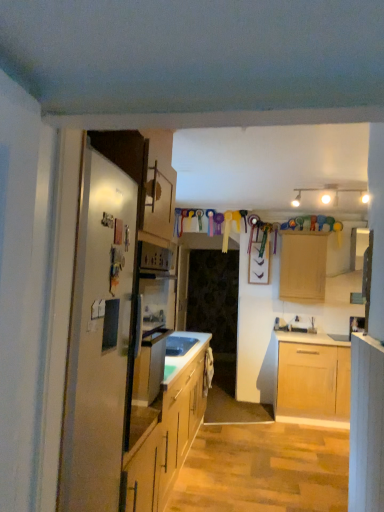
Measure the distance between light wood cabinet at upper center, which appears as the second cabinetry when viewed from the left, and camera.

They are 4.90 meters apart.

This screenshot has height=512, width=384. What are the coordinates of `white glossy sink at center` in the screenshot? It's located at 179,345.

Is light wood cabinet at upper center, which is counted as the first cabinetry, starting from the right, bigger or smaller than white glossy sink at center?

Clearly, light wood cabinet at upper center, which is counted as the first cabinetry, starting from the right, is larger in size than white glossy sink at center.

From a real-world perspective, is light wood cabinet at upper center, which is counted as the first cabinetry, starting from the right, positioned under white glossy sink at center based on gravity?

Incorrect, from a real-world perspective, light wood cabinet at upper center, which is counted as the first cabinetry, starting from the right, is higher than white glossy sink at center.

Who is shorter, light wood cabinet at upper center, marked as the first cabinetry in a back-to-front arrangement, or white glossy sink at center?

white glossy sink at center is shorter.

Measure the distance from light wood cabinet at upper center, which is counted as the first cabinetry, starting from the right, to white glossy sink at center.

light wood cabinet at upper center, which is counted as the first cabinetry, starting from the right, is 6.34 feet away from white glossy sink at center.

Does transparent glass door at center have a greater height compared to light wood cabinet at right, placed as the first cabinetry when sorted from left to right?

Indeed, transparent glass door at center has a greater height compared to light wood cabinet at right, placed as the first cabinetry when sorted from left to right.

Is transparent glass door at center facing away from light wood cabinet at right, acting as the 2th cabinetry starting from the right?

No, transparent glass door at center is not facing away from light wood cabinet at right, acting as the 2th cabinetry starting from the right.

The width and height of the screenshot is (384, 512). What are the coordinates of `glass door lying on the left of light wood cabinet at right, which is the first cabinetry from front to back` in the screenshot? It's located at (211, 297).

Does transparent glass door at center have a greater height compared to light wood cabinet at upper center, the second cabinetry viewed from the front?

Yes.

From a real-world perspective, is transparent glass door at center physically above light wood cabinet at upper center, which is counted as the first cabinetry, starting from the right?

No.

Considering the relative sizes of transparent glass door at center and light wood cabinet at upper center, the second cabinetry viewed from the front, in the image provided, is transparent glass door at center thinner than light wood cabinet at upper center, the second cabinetry viewed from the front,?

Indeed, transparent glass door at center has a lesser width compared to light wood cabinet at upper center, the second cabinetry viewed from the front.

Is transparent glass door at center facing away from light wood cabinet at upper center, the second cabinetry viewed from the front?

No, transparent glass door at center is not facing the opposite direction of light wood cabinet at upper center, the second cabinetry viewed from the front.

From a real-world perspective, is satin silver refrigerator at left physically above transparent glass door at center?

Yes.

Consider the image. How distant is satin silver refrigerator at left from transparent glass door at center?

3.74 meters.

From the image's perspective, is satin silver refrigerator at left located above transparent glass door at center?

Correct, satin silver refrigerator at left appears higher than transparent glass door at center in the image.

Is satin silver refrigerator at left further to camera compared to transparent glass door at center?

That is False.

Considering the positions of objects white glossy sink at center and light wood cabinet at upper center, which appears as the second cabinetry when viewed from the left, in the image provided, who is more to the right, white glossy sink at center or light wood cabinet at upper center, which appears as the second cabinetry when viewed from the left,?

light wood cabinet at upper center, which appears as the second cabinetry when viewed from the left, is more to the right.

Is light wood cabinet at upper center, marked as the first cabinetry in a back-to-front arrangement, located within white glossy sink at center?

No, light wood cabinet at upper center, marked as the first cabinetry in a back-to-front arrangement, is located outside of white glossy sink at center.

Is white glossy sink at center thinner than light wood cabinet at upper center, which appears as the second cabinetry when viewed from the left?

Indeed, white glossy sink at center has a lesser width compared to light wood cabinet at upper center, which appears as the second cabinetry when viewed from the left.

Can you confirm if satin silver refrigerator at left is taller than light wood cabinet at upper center, marked as the first cabinetry in a back-to-front arrangement?

Yes.

Considering the positions of point (111, 488) and point (310, 240), is point (111, 488) closer or farther from the camera than point (310, 240)?

Clearly, point (111, 488) is closer to the camera than point (310, 240).

Can we say satin silver refrigerator at left lies outside light wood cabinet at upper center, which is counted as the first cabinetry, starting from the right?

Yes, satin silver refrigerator at left is outside of light wood cabinet at upper center, which is counted as the first cabinetry, starting from the right.

Does satin silver refrigerator at left have a larger size compared to light wood cabinet at upper center, the second cabinetry viewed from the front?

Indeed, satin silver refrigerator at left has a larger size compared to light wood cabinet at upper center, the second cabinetry viewed from the front.

From a real-world perspective, is satin silver refrigerator at left below light wood cabinet at right, acting as the 2th cabinetry starting from the right?

No, from a real-world perspective, satin silver refrigerator at left is not under light wood cabinet at right, acting as the 2th cabinetry starting from the right.

Is satin silver refrigerator at left to the left or to the right of light wood cabinet at right, the second cabinetry viewed from the back, in the image?

satin silver refrigerator at left is to the left of light wood cabinet at right, the second cabinetry viewed from the back.

Can light wood cabinet at right, which is the first cabinetry from front to back, be found inside satin silver refrigerator at left?

No, light wood cabinet at right, which is the first cabinetry from front to back, is not a part of satin silver refrigerator at left.

Would you say satin silver refrigerator at left is a long distance from light wood cabinet at right, placed as the first cabinetry when sorted from left to right?

No, satin silver refrigerator at left is not far away from light wood cabinet at right, placed as the first cabinetry when sorted from left to right.

Image resolution: width=384 pixels, height=512 pixels. In order to click on sink on the left of the light wood cabinet at upper center, the second cabinetry viewed from the front in this screenshot , I will do `click(179, 345)`.

The image size is (384, 512). Identify the location of glass door that appears behind the light wood cabinet at right, the second cabinetry viewed from the back. (211, 297).

Based on the photo, considering their positions, is transparent glass door at center positioned closer to white glossy sink at center than light wood cabinet at upper center, marked as the first cabinetry in a back-to-front arrangement?

Among the two, transparent glass door at center is located nearer to white glossy sink at center.

Estimate the real-world distances between objects in this image. Which object is further from light wood cabinet at upper center, which is counted as the first cabinetry, starting from the right, satin silver refrigerator at left or white glossy sink at center?

satin silver refrigerator at left is positioned further to the anchor light wood cabinet at upper center, which is counted as the first cabinetry, starting from the right.

Considering their positions, is light wood cabinet at upper center, which appears as the second cabinetry when viewed from the left, positioned closer to white glossy sink at center than light wood cabinet at right, the second cabinetry viewed from the back?

light wood cabinet at right, the second cabinetry viewed from the back, is positioned closer to the anchor white glossy sink at center.

Based on their spatial positions, is satin silver refrigerator at left or light wood cabinet at upper center, the second cabinetry viewed from the front, closer to light wood cabinet at right, which is the first cabinetry from front to back?

Based on the image, satin silver refrigerator at left appears to be nearer to light wood cabinet at right, which is the first cabinetry from front to back.

Based on their spatial positions, is white glossy sink at center or satin silver refrigerator at left closer to transparent glass door at center?

white glossy sink at center is positioned closer to the anchor transparent glass door at center.

Estimate the real-world distances between objects in this image. Which object is further from satin silver refrigerator at left, white glossy sink at center or light wood cabinet at upper center, marked as the first cabinetry in a back-to-front arrangement?

The object further to satin silver refrigerator at left is light wood cabinet at upper center, marked as the first cabinetry in a back-to-front arrangement.

Considering their positions, is satin silver refrigerator at left positioned closer to white glossy sink at center than light wood cabinet at upper center, which appears as the second cabinetry when viewed from the left?

light wood cabinet at upper center, which appears as the second cabinetry when viewed from the left, is positioned closer to the anchor white glossy sink at center.

Which object lies nearer to the anchor point white glossy sink at center, light wood cabinet at right, placed as the first cabinetry when sorted from left to right, or satin silver refrigerator at left?

light wood cabinet at right, placed as the first cabinetry when sorted from left to right, lies closer to white glossy sink at center than the other object.

You are a GUI agent. You are given a task and a screenshot of the screen. Output one action in this format:
    pyautogui.click(x=<x>, y=<y>)
    Task: Click on the sink positioned between light wood cabinet at right, which is the first cabinetry from front to back, and light wood cabinet at upper center, which appears as the second cabinetry when viewed from the left, from near to far
    Image resolution: width=384 pixels, height=512 pixels.
    Given the screenshot: What is the action you would take?
    pyautogui.click(x=179, y=345)

This screenshot has width=384, height=512. Identify the location of sink between satin silver refrigerator at left and transparent glass door at center from front to back. (179, 345).

Identify the location of cabinetry between light wood cabinet at right, acting as the 2th cabinetry starting from the right, and transparent glass door at center from front to back. The height and width of the screenshot is (512, 384). (303, 266).

Locate an element on the screen. The height and width of the screenshot is (512, 384). cabinetry positioned between satin silver refrigerator at left and light wood cabinet at upper center, the second cabinetry viewed from the front, from near to far is located at coordinates (366, 425).